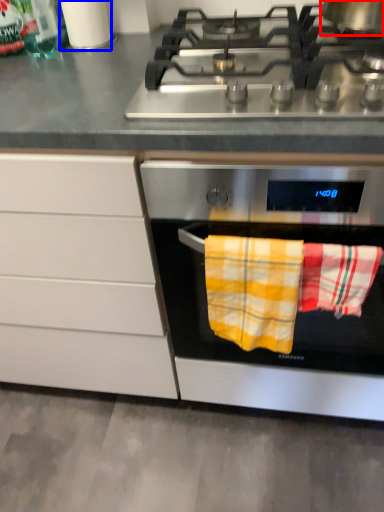
Question: Among these objects, which one is nearest to the camera, kitchen appliance (highlighted by a red box) or appliance (highlighted by a blue box)?

Choices:
 (A) kitchen appliance
 (B) appliance

Answer: (A)